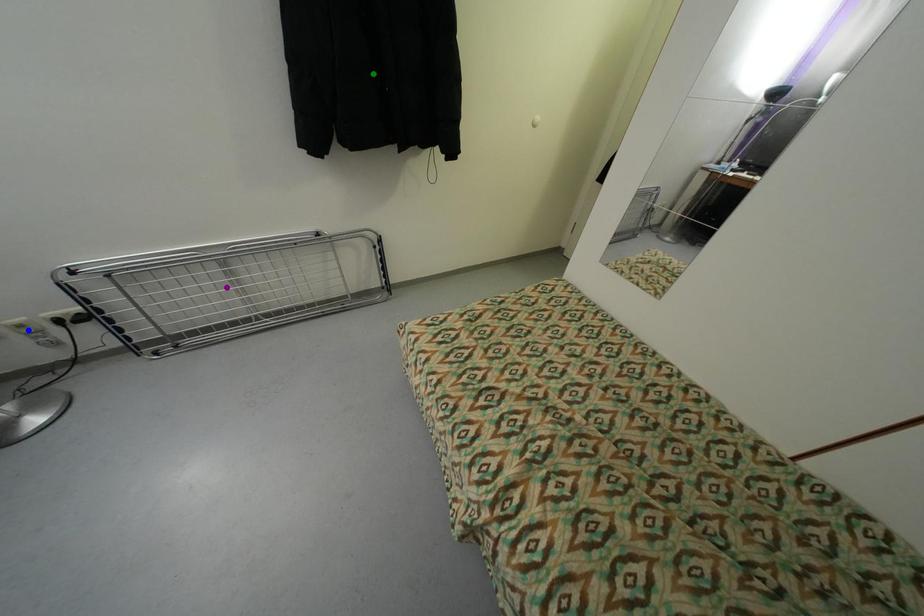
Order these from nearest to farthest:
green point | blue point | purple point

blue point < green point < purple point